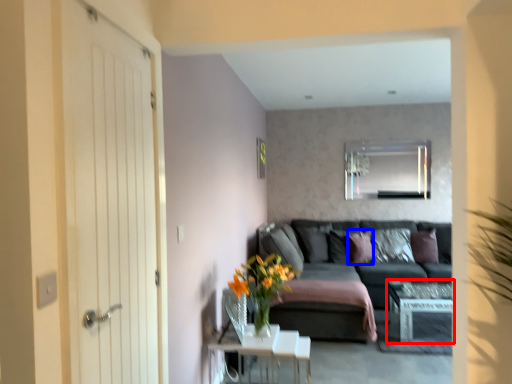
Question: Which object appears farthest to the camera in this image, table (highlighted by a red box) or pillow (highlighted by a blue box)?

Choices:
 (A) table
 (B) pillow

Answer: (B)